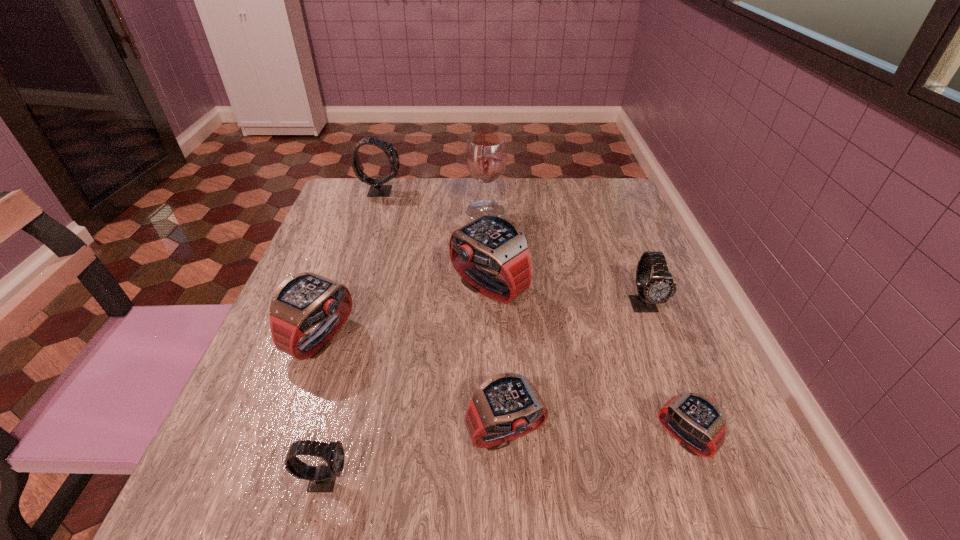
Identify the location of blank region between the third biggest red watch and the nearest gray watch. This screenshot has height=540, width=960. (415, 457).

The image size is (960, 540). I want to click on free space between the second smallest red watch and the biggest red watch, so click(x=497, y=361).

The image size is (960, 540). What are the coordinates of `free spot between the third biggest red watch and the second biggest red watch` in the screenshot? It's located at (414, 387).

Image resolution: width=960 pixels, height=540 pixels. In order to click on object that can be found as the fourth closest to the leftmost red watch in this screenshot , I will do `click(486, 155)`.

I want to click on object that is the sixth nearest to the red wineglass, so click(x=695, y=421).

What are the coordinates of `watch that is the second closest one to the second biggest red watch` in the screenshot? It's located at (494, 242).

This screenshot has height=540, width=960. Find the location of `watch that can be found as the fourth closest to the shortest object`. watch that can be found as the fourth closest to the shortest object is located at coordinates (322, 478).

Where is `gray watch that is the second closest one to the second farthest gray watch`? gray watch that is the second closest one to the second farthest gray watch is located at coordinates (377, 189).

Select which gray watch is the second closest to the smallest gray watch. Please provide its 2D coordinates. Your answer should be formatted as a tuple, i.e. [(x, y)], where the tuple contains the x and y coordinates of a point satisfying the conditions above.

[(377, 189)]

Locate which red watch ranks third in proximity to the biggest red watch. Please provide its 2D coordinates. Your answer should be formatted as a tuple, i.e. [(x, y)], where the tuple contains the x and y coordinates of a point satisfying the conditions above.

[(695, 421)]